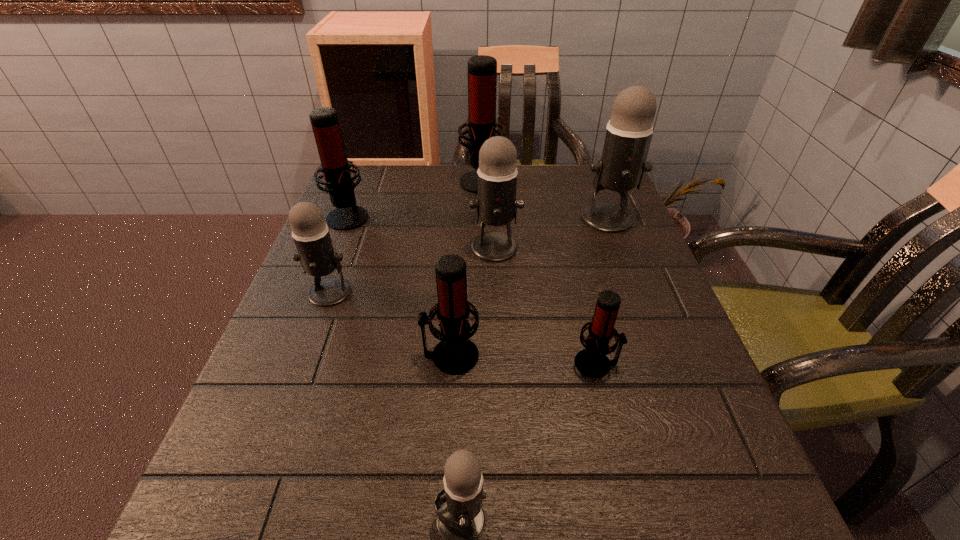
This screenshot has width=960, height=540. Identify the location of the rightmost red microphone. (592, 361).

The width and height of the screenshot is (960, 540). Identify the location of the smallest red microphone. (592, 361).

The height and width of the screenshot is (540, 960). I want to click on free space located 0.260m on the front of the farthest object, so click(482, 255).

I want to click on vacant space located on the left of the rightmost gray microphone, so click(468, 218).

You are a GUI agent. You are given a task and a screenshot of the screen. Output one action in this format:
    pyautogui.click(x=<x>, y=<y>)
    Task: Click on the free space located 0.110m on the back of the second biggest red microphone
    The image size is (960, 540).
    Given the screenshot: What is the action you would take?
    pyautogui.click(x=362, y=181)

This screenshot has width=960, height=540. In order to click on vacant area situated on the back of the third smallest gray microphone in this screenshot , I will do `click(493, 210)`.

This screenshot has width=960, height=540. I want to click on free space located on the right of the third biggest red microphone, so click(540, 356).

Locate an element on the screen. free space located on the front of the third farthest gray microphone is located at coordinates (254, 503).

The height and width of the screenshot is (540, 960). I want to click on free space located on the left of the smallest red microphone, so click(546, 363).

I want to click on object that is at the far left corner, so click(x=335, y=166).